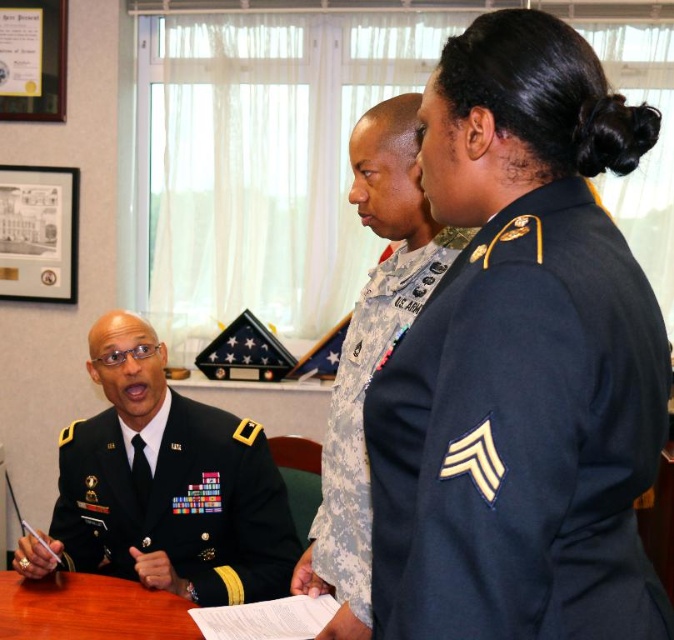
Question: Considering the relative positions of dark green military uniform at left and camouflage fabric uniform at center in the image provided, where is dark green military uniform at left located with respect to camouflage fabric uniform at center?

Choices:
 (A) above
 (B) below

Answer: (B)

Question: Based on their relative distances, which object is nearer to the navy blue fabric uniform at right?

Choices:
 (A) camouflage fabric uniform at center
 (B) dark green military uniform at left
 (C) brown wooden table at center

Answer: (A)

Question: Is navy blue fabric uniform at right wider than brown wooden table at center?

Choices:
 (A) no
 (B) yes

Answer: (A)

Question: Based on their relative distances, which object is farther from the brown wooden table at center?

Choices:
 (A) camouflage fabric uniform at center
 (B) dark green military uniform at left
 (C) navy blue fabric uniform at right

Answer: (C)

Question: Which of these objects is positioned farthest from the brown wooden table at center?

Choices:
 (A) navy blue fabric uniform at right
 (B) dark green military uniform at left

Answer: (A)

Question: Does dark green military uniform at left come behind camouflage fabric uniform at center?

Choices:
 (A) yes
 (B) no

Answer: (A)